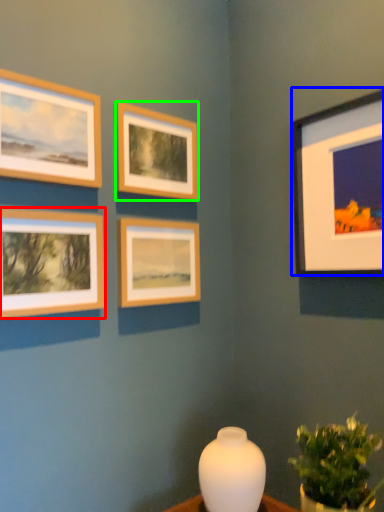
Question: Estimate the real-world distances between objects in this image. Which object is closer to picture frame (highlighted by a red box), picture frame (highlighted by a blue box) or picture frame (highlighted by a green box)?

Choices:
 (A) picture frame
 (B) picture frame

Answer: (B)